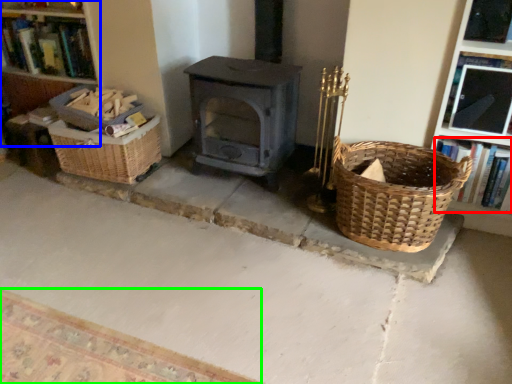
Question: Considering the real-world distances, which object is closest to book (highlighted by a red box)? bookshelf (highlighted by a blue box) or mat (highlighted by a green box).

Choices:
 (A) bookshelf
 (B) mat

Answer: (B)